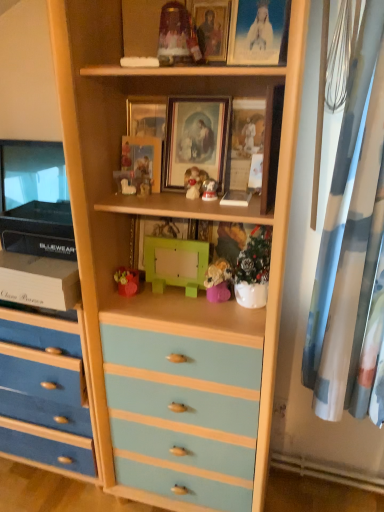
Measure the distance between matte glass jar at upper center, which is counted as the fourth toy, starting from the right, and camera.

They are 1.07 meters apart.

Describe the element at coordinates (146, 117) in the screenshot. Image resolution: width=384 pixels, height=512 pixels. I see `metallic gold picture frame at upper center, acting as the 4th picture frame starting from the right` at that location.

What do you see at coordinates (193, 182) in the screenshot?
I see `matte porcelain figurine at center, the 3th toy viewed from the left` at bounding box center [193, 182].

You are a GUI agent. You are given a task and a screenshot of the screen. Output one action in this format:
    pyautogui.click(x=<x>, y=<y>)
    Task: Click on the matte gold picture frame at center, arranged as the 5th picture frame when viewed from the right
    The image size is (384, 512).
    Given the screenshot: What is the action you would take?
    pyautogui.click(x=143, y=159)

You are a GUI agent. You are given a task and a screenshot of the screen. Output one action in this format:
    pyautogui.click(x=<x>, y=<y>)
    Task: Click on the satin gold figurine at center, which is the fourth toy in left-to-right order
    The height and width of the screenshot is (512, 384).
    Given the screenshot: What is the action you would take?
    pyautogui.click(x=209, y=190)

This screenshot has height=512, width=384. In order to click on matte glass jar at upper center, which is the fifth toy in bottom-to-top order in this screenshot , I will do `click(177, 36)`.

Which is closer to the camera, (158, 177) or (130, 276)?

Point (158, 177)

Which object is thinner, matte gold picture frame at center, the first picture frame from the left, or matte red plush toy at center, the 5th toy viewed from the right?

With smaller width is matte gold picture frame at center, the first picture frame from the left.

Considering the relative sizes of matte gold picture frame at center, the first picture frame from the left, and matte red plush toy at center, the 5th toy viewed from the right, in the image provided, is matte gold picture frame at center, the first picture frame from the left, smaller than matte red plush toy at center, the 5th toy viewed from the right,?

No.

Between matte red plush toy at center, marked as the first toy in a left-to-right arrangement, and matte wooden picture frame at center, the 3th picture frame viewed from the right, which one has less height?

matte red plush toy at center, marked as the first toy in a left-to-right arrangement.

Is matte red plush toy at center, the 5th toy viewed from the right, touching matte wooden picture frame at center, the 3th picture frame from the left?

No, matte red plush toy at center, the 5th toy viewed from the right, is not in contact with matte wooden picture frame at center, the 3th picture frame from the left.

Considering the positions of objects matte red plush toy at center, the first toy when ordered from bottom to top, and matte wooden picture frame at center, the 3th picture frame from the left, in the image provided, who is more to the right, matte red plush toy at center, the first toy when ordered from bottom to top, or matte wooden picture frame at center, the 3th picture frame from the left,?

Positioned to the right is matte wooden picture frame at center, the 3th picture frame from the left.

Which of these two, satin gold figurine at center, acting as the 3th toy starting from the bottom, or matte porcelain figurine at center, the 3th toy viewed from the left, is wider?

Wider between the two is matte porcelain figurine at center, the 3th toy viewed from the left.

In terms of height, does satin gold figurine at center, acting as the 3th toy starting from the bottom, look taller or shorter compared to matte porcelain figurine at center, the 3th toy viewed from the left?

Clearly, satin gold figurine at center, acting as the 3th toy starting from the bottom, is shorter compared to matte porcelain figurine at center, the 3th toy viewed from the left.

Is satin gold figurine at center, which is the fourth toy in left-to-right order, positioned with its back to matte porcelain figurine at center, marked as the 2th toy in a top-to-bottom arrangement?

No, satin gold figurine at center, which is the fourth toy in left-to-right order, is not facing away from matte porcelain figurine at center, marked as the 2th toy in a top-to-bottom arrangement.

From a real-world perspective, which is physically above, satin gold figurine at center, the second toy positioned from the right, or matte porcelain figurine at center, marked as the 2th toy in a top-to-bottom arrangement?

In real-world perspective, matte porcelain figurine at center, marked as the 2th toy in a top-to-bottom arrangement, is above.

From the image's perspective, does metallic gold picture frame at upper center, acting as the 4th picture frame starting from the right, appear higher than matte gold picture frame at center, arranged as the 5th picture frame when viewed from the right?

Yes, from the image's perspective, metallic gold picture frame at upper center, acting as the 4th picture frame starting from the right, is on top of matte gold picture frame at center, arranged as the 5th picture frame when viewed from the right.

Between metallic gold picture frame at upper center, acting as the 4th picture frame starting from the right, and matte gold picture frame at center, the first picture frame from the left, which one appears on the left side from the viewer's perspective?

matte gold picture frame at center, the first picture frame from the left, is more to the left.

Considering the relative sizes of metallic gold picture frame at upper center, acting as the 4th picture frame starting from the right, and matte gold picture frame at center, the first picture frame from the left, in the image provided, is metallic gold picture frame at upper center, acting as the 4th picture frame starting from the right, bigger than matte gold picture frame at center, the first picture frame from the left,?

Incorrect, metallic gold picture frame at upper center, acting as the 4th picture frame starting from the right, is not larger than matte gold picture frame at center, the first picture frame from the left.

In terms of width, does matte porcelain figurine at center, the third toy when ordered from right to left, look wider or thinner when compared to matte glass jar at upper center, which is counted as the fourth toy, starting from the right?

matte porcelain figurine at center, the third toy when ordered from right to left, is thinner than matte glass jar at upper center, which is counted as the fourth toy, starting from the right.

Considering their positions, is matte porcelain figurine at center, marked as the 2th toy in a top-to-bottom arrangement, located in front of or behind matte glass jar at upper center, which is the fifth toy in bottom-to-top order?

matte porcelain figurine at center, marked as the 2th toy in a top-to-bottom arrangement, is positioned farther from the viewer than matte glass jar at upper center, which is the fifth toy in bottom-to-top order.

This screenshot has height=512, width=384. I want to click on toy located above the matte porcelain figurine at center, the third toy when ordered from right to left (from a real-world perspective), so click(177, 36).

In the image, is matte gold picture frame at center, the first picture frame from the left, on the left side or the right side of purple matte toy at center, acting as the 5th toy starting from the left?

Clearly, matte gold picture frame at center, the first picture frame from the left, is on the left of purple matte toy at center, acting as the 5th toy starting from the left, in the image.

Is matte gold picture frame at center, arranged as the 5th picture frame when viewed from the right, completely or partially outside of purple matte toy at center, marked as the second toy in a bottom-to-top arrangement?

Yes.

Which is behind, point (146, 164) or point (208, 288)?

The point (146, 164) is more distant.

From a real-world perspective, who is located higher, matte gold picture frame at center, the first picture frame from the left, or purple matte toy at center, marked as the second toy in a bottom-to-top arrangement?

From a 3D spatial view, matte gold picture frame at center, the first picture frame from the left, is above.

Which of these two, matte red plush toy at center, the first toy when ordered from bottom to top, or matte porcelain figurine at center, arranged as the 4th toy when ordered from the bottom, stands taller?

With more height is matte porcelain figurine at center, arranged as the 4th toy when ordered from the bottom.

Is matte red plush toy at center, the 5th toy viewed from the right, not close to matte porcelain figurine at center, marked as the 2th toy in a top-to-bottom arrangement?

Actually, matte red plush toy at center, the 5th toy viewed from the right, and matte porcelain figurine at center, marked as the 2th toy in a top-to-bottom arrangement, are a little close together.

Does matte red plush toy at center, marked as the first toy in a left-to-right arrangement, turn towards matte porcelain figurine at center, arranged as the 4th toy when ordered from the bottom?

No, matte red plush toy at center, marked as the first toy in a left-to-right arrangement, is not oriented towards matte porcelain figurine at center, arranged as the 4th toy when ordered from the bottom.

From a real-world perspective, who is located higher, matte red plush toy at center, the 5th toy viewed from the right, or matte porcelain figurine at center, arranged as the 4th toy when ordered from the bottom?

matte porcelain figurine at center, arranged as the 4th toy when ordered from the bottom, from a real-world perspective.

There is a matte gold picture frame at center, the first picture frame from the left. Identify the location of the 4th toy below it (from a real-world perspective). (127, 281).

Where is `the 3rd picture frame to the right when counting from the matte red plush toy at center, the 5th toy viewed from the right`? Image resolution: width=384 pixels, height=512 pixels. the 3rd picture frame to the right when counting from the matte red plush toy at center, the 5th toy viewed from the right is located at coordinates (195, 140).

From the image, which object appears to be nearer to matte porcelain figurine at center, arranged as the 4th toy when ordered from the bottom, purple matte toy at center, which is the fourth toy from top to bottom, or metallic gold picture frame at upper center, acting as the 4th picture frame starting from the right?

Based on the image, metallic gold picture frame at upper center, acting as the 4th picture frame starting from the right, appears to be nearer to matte porcelain figurine at center, arranged as the 4th toy when ordered from the bottom.

Looking at the image, which one is located closer to wooden picture frame at upper center, acting as the fourth picture frame starting from the left, matte porcelain figurine at center, arranged as the 4th toy when ordered from the bottom, or matte gold picture frame at center, the first picture frame from the left?

The object closer to wooden picture frame at upper center, acting as the fourth picture frame starting from the left, is matte gold picture frame at center, the first picture frame from the left.

From the picture: Looking at the image, which one is located further to metallic gold picture frame at upper center, acting as the 4th picture frame starting from the right, satin gold figurine at center, the second toy positioned from the right, or matte gold picture frame at upper center, the 1th picture frame in the right-to-left sequence?

matte gold picture frame at upper center, the 1th picture frame in the right-to-left sequence, lies further to metallic gold picture frame at upper center, acting as the 4th picture frame starting from the right, than the other object.

Considering their positions, is wooden picture frame at upper center, placed as the second picture frame when sorted from right to left, positioned closer to metallic gold picture frame at upper center, acting as the 4th picture frame starting from the right, than matte gold picture frame at upper center, the 1th picture frame in the right-to-left sequence?

The object closer to metallic gold picture frame at upper center, acting as the 4th picture frame starting from the right, is wooden picture frame at upper center, placed as the second picture frame when sorted from right to left.

Based on their spatial positions, is matte porcelain figurine at center, the third toy when ordered from right to left, or purple matte toy at center, marked as the second toy in a bottom-to-top arrangement, closer to wooden picture frame at upper center, placed as the second picture frame when sorted from right to left?

matte porcelain figurine at center, the third toy when ordered from right to left, lies closer to wooden picture frame at upper center, placed as the second picture frame when sorted from right to left, than the other object.

Consider the image. From the image, which object appears to be nearer to matte gold picture frame at upper center, the fifth picture frame positioned from the left, matte glass jar at upper center, arranged as the first toy when viewed from the top, or matte red plush toy at center, the 5th toy viewed from the right?

→ matte glass jar at upper center, arranged as the first toy when viewed from the top.

Considering their positions, is wooden picture frame at upper center, acting as the fourth picture frame starting from the left, positioned closer to purple matte toy at center, which is counted as the 1th toy, starting from the right, than matte glass jar at upper center, which is counted as the fourth toy, starting from the right?

Based on the image, matte glass jar at upper center, which is counted as the fourth toy, starting from the right, appears to be nearer to purple matte toy at center, which is counted as the 1th toy, starting from the right.

Considering their positions, is matte glass jar at upper center, arranged as the first toy when viewed from the top, positioned closer to metallic gold picture frame at upper center, acting as the 4th picture frame starting from the right, than satin gold figurine at center, acting as the third toy starting from the top?

Among the two, matte glass jar at upper center, arranged as the first toy when viewed from the top, is located nearer to metallic gold picture frame at upper center, acting as the 4th picture frame starting from the right.

Locate an element on the screen. toy that lies between wooden picture frame at upper center, placed as the second picture frame when sorted from right to left, and matte gold picture frame at center, arranged as the 5th picture frame when viewed from the right, from top to bottom is located at coordinates (177, 36).

You are a GUI agent. You are given a task and a screenshot of the screen. Output one action in this format:
    pyautogui.click(x=<x>, y=<y>)
    Task: Click on the toy between matte gold picture frame at upper center, the 1th picture frame in the right-to-left sequence, and matte porcelain figurine at center, marked as the 2th toy in a top-to-bottom arrangement, in the vertical direction
    The width and height of the screenshot is (384, 512).
    Given the screenshot: What is the action you would take?
    pyautogui.click(x=177, y=36)

Where is `toy between matte gold picture frame at upper center, the fifth picture frame positioned from the left, and matte gold picture frame at center, the first picture frame from the left, in the vertical direction`? toy between matte gold picture frame at upper center, the fifth picture frame positioned from the left, and matte gold picture frame at center, the first picture frame from the left, in the vertical direction is located at coordinates (177, 36).

Where is `toy between metallic gold picture frame at upper center, acting as the 4th picture frame starting from the right, and satin gold figurine at center, which is the fourth toy in left-to-right order, in the vertical direction`? The height and width of the screenshot is (512, 384). toy between metallic gold picture frame at upper center, acting as the 4th picture frame starting from the right, and satin gold figurine at center, which is the fourth toy in left-to-right order, in the vertical direction is located at coordinates (193, 182).